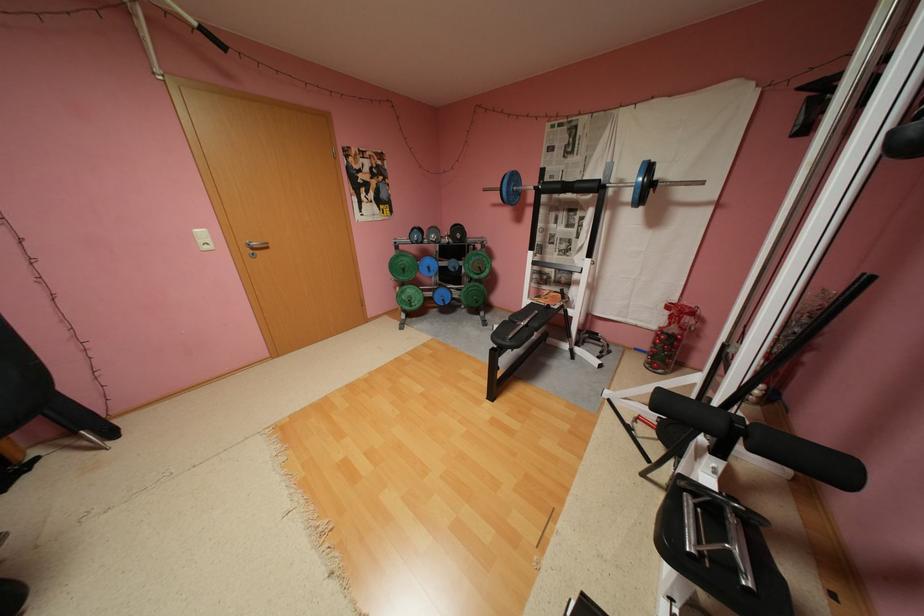
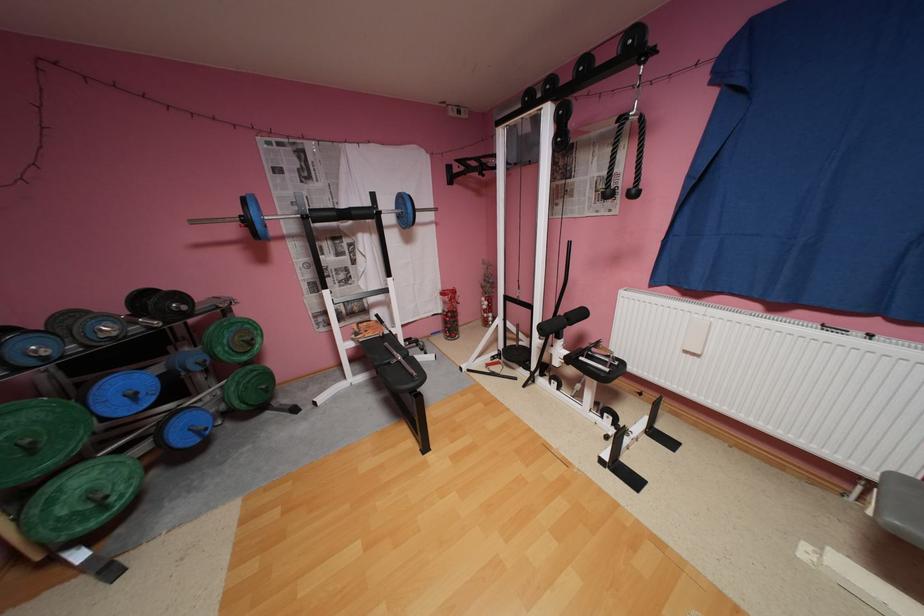
Find the pixel in the second image that matches (x=438, y=268) in the first image.

(142, 395)